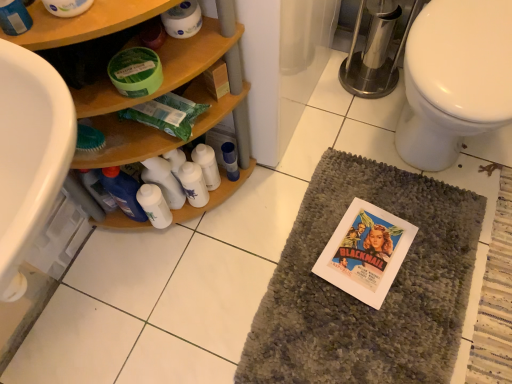
Question: Looking at the image, does white plastic bottles at center, positioned as the 1th bottle in left-to-right order, seem bigger or smaller compared to blue glossy bottle at center, the first bottle positioned from the right?

Choices:
 (A) small
 (B) big

Answer: (B)

Question: In the image, is white plastic bottles at center, positioned as the 1th bottle in left-to-right order, on the left side or the right side of blue glossy bottle at center, the second bottle from the left?

Choices:
 (A) right
 (B) left

Answer: (B)

Question: Which object is the closest to the woodenmaterial/texturebathroom cabinet at left?

Choices:
 (A) gray textured bath mat at center
 (B) white plastic bottles at center, the 2th bottle in the right-to-left sequence
 (C) white glossy toilet at right
 (D) white paper comic book at center
 (E) white matte lotion at center, marked as the 2th toiletry in a right-to-left arrangement

Answer: (B)

Question: Which of these objects is positioned closest to the white glossy toilet at right?

Choices:
 (A) white plastic bottles at center, positioned as the 1th bottle in left-to-right order
 (B) white matte toilet paper at upper center
 (C) white matte lotion at center, marked as the 1th toiletry in a left-to-right arrangement
 (D) gray textured bath mat at center
 (E) woodenmaterial/texturebathroom cabinet at left

Answer: (D)